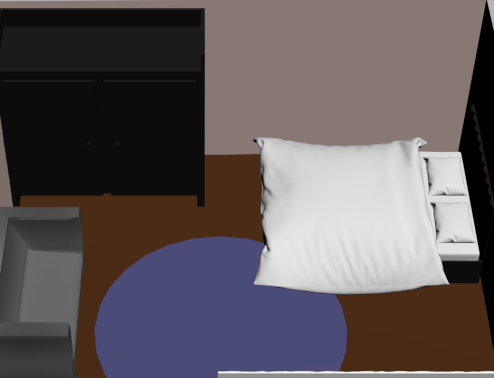
Locate an element on the screen. pillows is located at coordinates (451, 179), (453, 224).